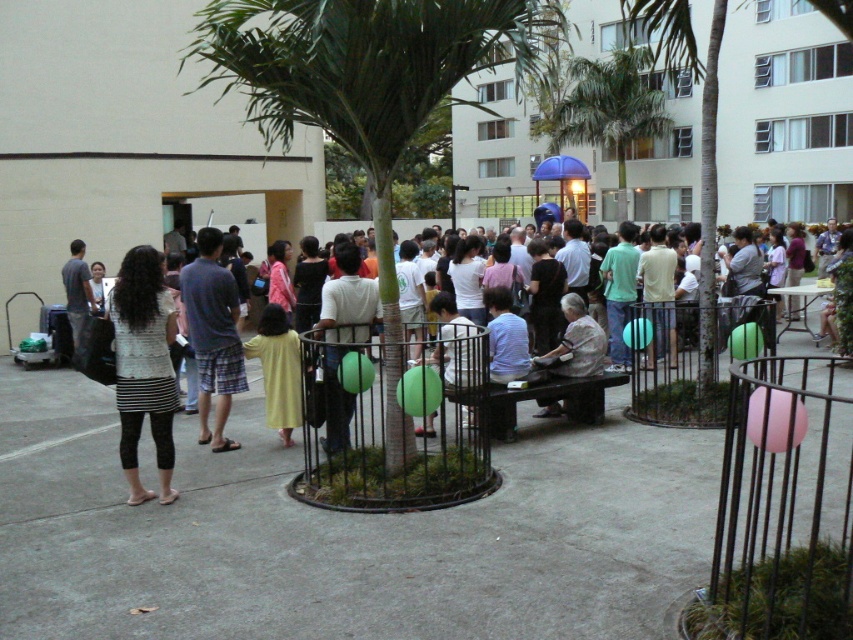
Between striped fabric shirt at left and green leafy palm tree at center, which one has more height?

striped fabric shirt at left

Measure the distance between point (132, 332) and camera.

20.36 feet

I want to click on striped fabric shirt at left, so click(x=143, y=365).

Between point (325, 368) and point (587, 323), which one is positioned in front?

Positioned in front is point (325, 368).

Can you confirm if white cotton shirt at center is smaller than light brown fabric shirt at center?

Actually, white cotton shirt at center might be larger than light brown fabric shirt at center.

Does point (344, 284) come in front of point (556, 372)?

Yes, it is.

You are a GUI agent. You are given a task and a screenshot of the screen. Output one action in this format:
    pyautogui.click(x=<x>, y=<y>)
    Task: Click on the white cotton shirt at center
    This screenshot has height=640, width=853.
    Given the screenshot: What is the action you would take?
    pyautogui.click(x=347, y=300)

How distant is plaid shorts at center from yellow fabric dress at center?

The distance of plaid shorts at center from yellow fabric dress at center is 1.93 meters.

Does plaid shorts at center have a greater width compared to yellow fabric dress at center?

Indeed, plaid shorts at center has a greater width compared to yellow fabric dress at center.

Find the location of a particular element. The height and width of the screenshot is (640, 853). plaid shorts at center is located at coordinates (213, 333).

What are the coordinates of `plaid shorts at center` in the screenshot? It's located at (213, 333).